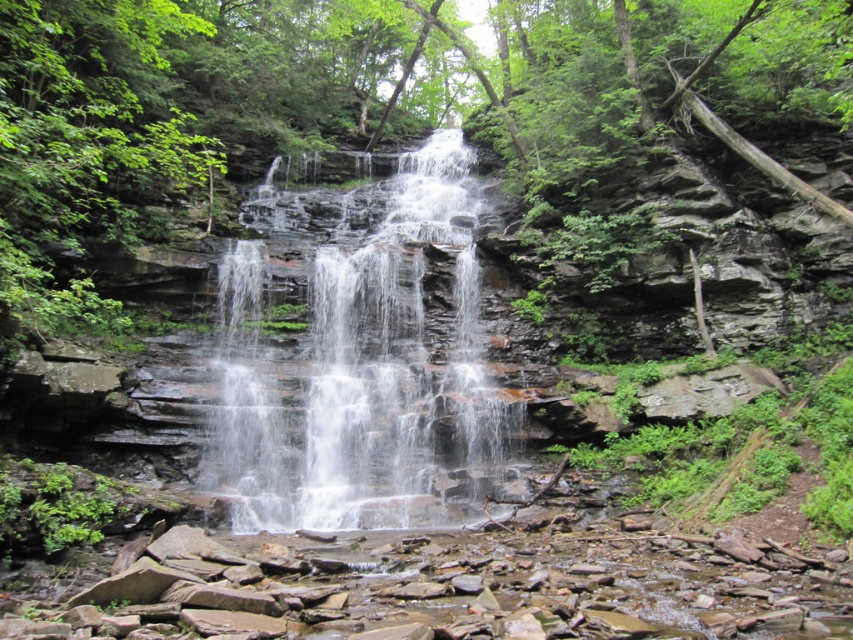
From the picture: You are standing at the edge of the waterfall and notice a specific point in the image labeled as point [352,100]. Based on the scene description, what is the most likely feature located at that coordinate?

The point [352,100] corresponds to the green leafy forest at center.

From the picture: You are a hiker standing at the edge of the waterfall. You notice the green leafy forest at center and the clear water at center. Which one is taller?

The green leafy forest at center is taller than the clear water at center.